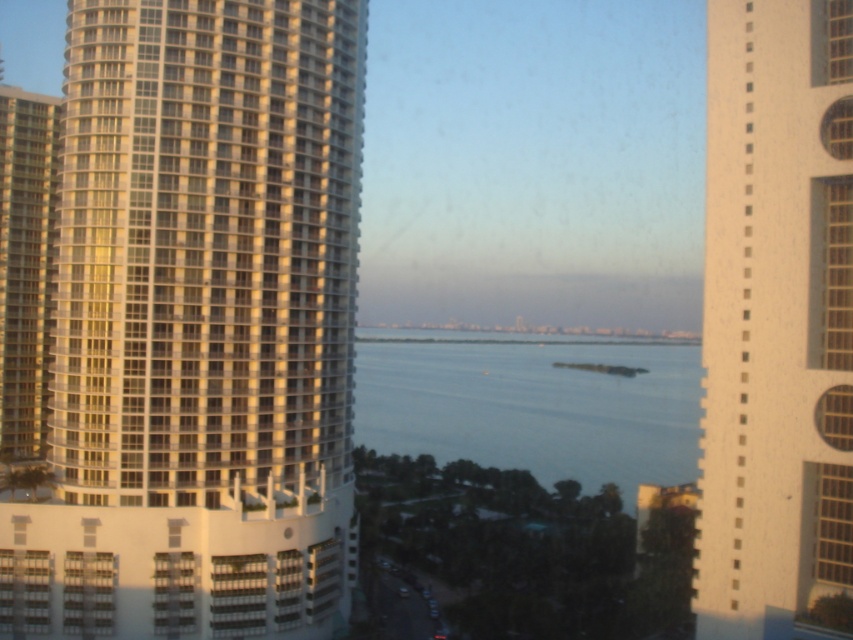
Does white glass building at left have a larger size compared to matte glass windows at left?

Indeed, white glass building at left has a larger size compared to matte glass windows at left.

Looking at this image, between white glass building at left and matte glass windows at left, which one appears on the right side from the viewer's perspective?

Positioned to the right is white glass building at left.

Image resolution: width=853 pixels, height=640 pixels. Find the location of `white glass building at left`. white glass building at left is located at coordinates (183, 321).

Is white textured building at right in front of matte glass windows at left?

Yes.

What are the coordinates of `white textured building at right` in the screenshot? It's located at (773, 307).

Find the location of a particular element. The width and height of the screenshot is (853, 640). white textured building at right is located at coordinates 773,307.

You are a GUI agent. You are given a task and a screenshot of the screen. Output one action in this format:
    pyautogui.click(x=<x>, y=<y>)
    Task: Click on the white textured building at right
    
    Given the screenshot: What is the action you would take?
    pyautogui.click(x=773, y=307)

Based on the photo, can you confirm if white textured building at right is wider than wooden window at right?

Yes.

Measure the distance between white textured building at right and camera.

The distance of white textured building at right from camera is 54.44 meters.

Between point (709, 180) and point (824, 561), which one is positioned in front?

Point (824, 561) is more forward.

Where is `white textured building at right`? The height and width of the screenshot is (640, 853). white textured building at right is located at coordinates (773, 307).